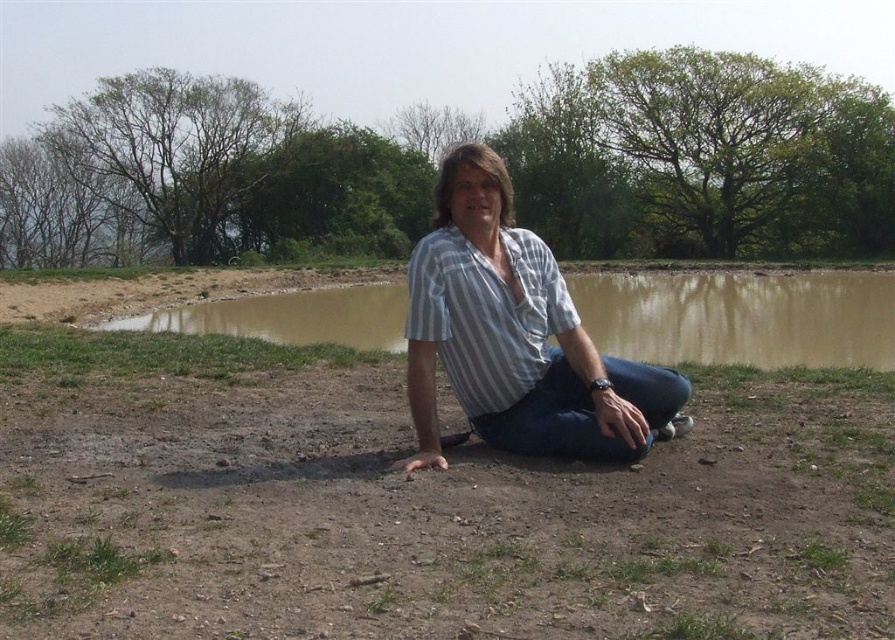
Question: Can you confirm if striped cotton shirt at center is thinner than brown muddy water at center?

Choices:
 (A) no
 (B) yes

Answer: (B)

Question: Can you confirm if striped cotton shirt at center is bigger than brown muddy water at center?

Choices:
 (A) yes
 (B) no

Answer: (B)

Question: Which point appears farthest from the camera in this image?

Choices:
 (A) (595, 332)
 (B) (671, 390)
 (C) (156, 337)

Answer: (A)

Question: Which point is farther from the camera taking this photo?

Choices:
 (A) (482, 396)
 (B) (736, 445)

Answer: (B)

Question: Which point appears farthest from the camera in this image?

Choices:
 (A) (124, 548)
 (B) (418, 243)

Answer: (B)

Question: Does brown dirt field at center come in front of striped cotton shirt at center?

Choices:
 (A) no
 (B) yes

Answer: (B)